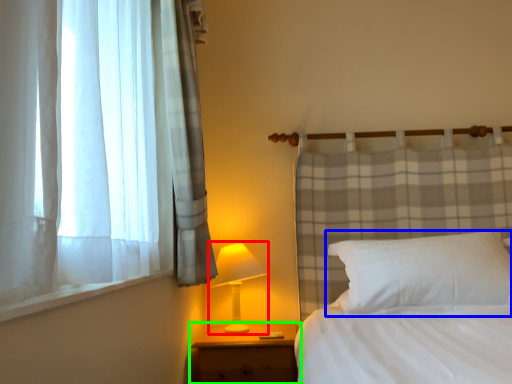
Question: Which object is the farthest from table lamp (highlighted by a red box)? Choose among these: pillow (highlighted by a blue box) or nightstand (highlighted by a green box).

Choices:
 (A) pillow
 (B) nightstand

Answer: (A)